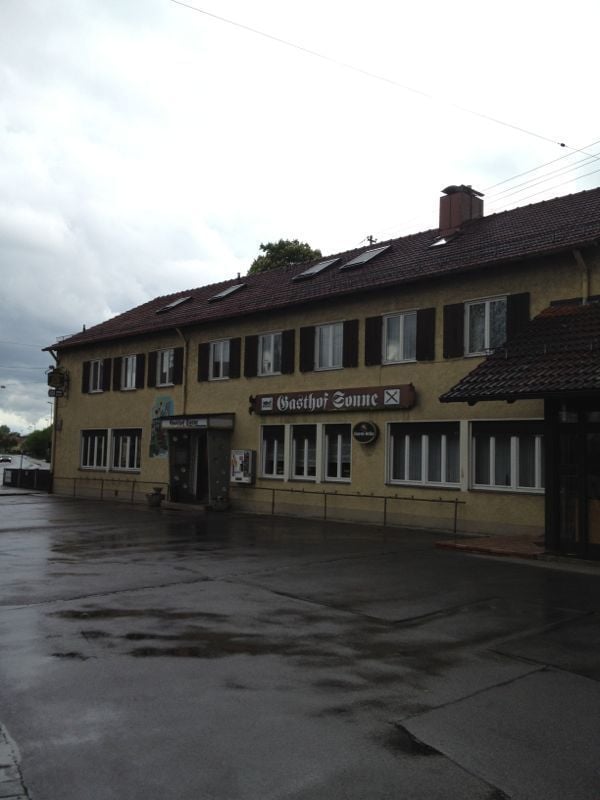
I want to click on door, so click(197, 481).